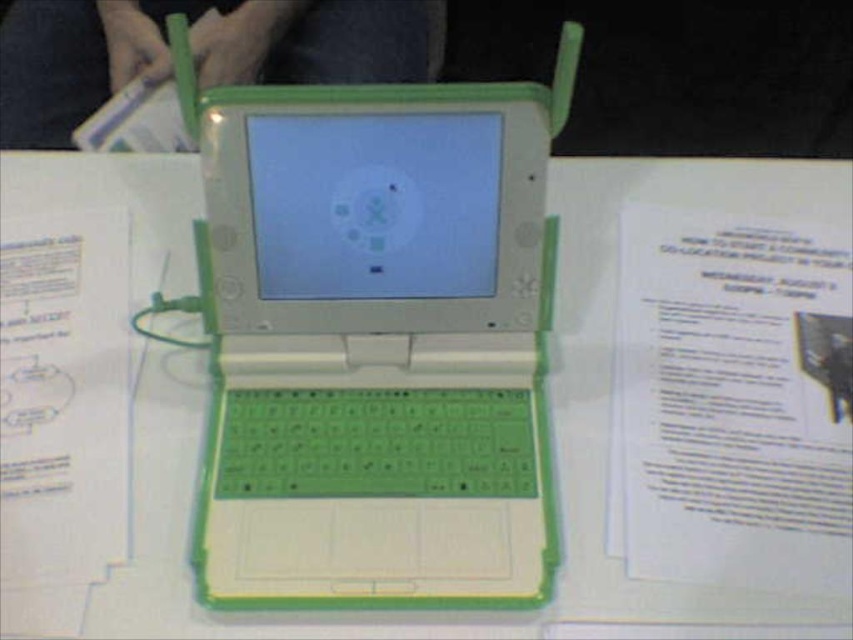
Does point (309, 166) come farther from viewer compared to point (767, 380)?

No.

Who is shorter, green plastic laptop at center or white paper at upper right?

With less height is white paper at upper right.

Measure the distance between green plastic laptop at center and camera.

green plastic laptop at center and camera are 41.56 centimeters apart.

Image resolution: width=853 pixels, height=640 pixels. In order to click on green plastic laptop at center in this screenshot , I will do `click(376, 340)`.

Can you confirm if green plastic laptop at center is wider than white paper at left?

Yes, green plastic laptop at center is wider than white paper at left.

Can you confirm if green plastic laptop at center is shorter than white paper at left?

No, green plastic laptop at center is not shorter than white paper at left.

At what (x,y) coordinates should I click in order to perform the action: click on green plastic laptop at center. Please return your answer as a coordinate pair (x, y). Image resolution: width=853 pixels, height=640 pixels. Looking at the image, I should click on (376, 340).

Between white paper at upper right and white paper at left, which one is positioned lower?

white paper at left

Which is above, white paper at upper right or white paper at left?

white paper at upper right is above.

Who is more distant from viewer, (751, 282) or (61, 260)?

The point (61, 260) is behind.

You are a GUI agent. You are given a task and a screenshot of the screen. Output one action in this format:
    pyautogui.click(x=<x>, y=<y>)
    Task: Click on the white paper at upper right
    The height and width of the screenshot is (640, 853).
    Given the screenshot: What is the action you would take?
    pyautogui.click(x=734, y=401)